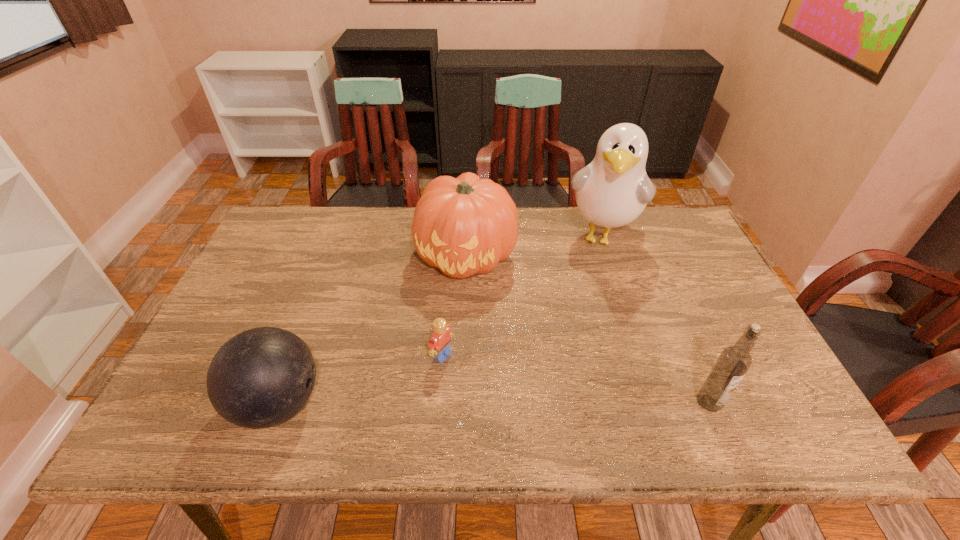
Find the location of a particular element. This screenshot has width=960, height=540. bowling ball is located at coordinates (261, 377).

You are a GUI agent. You are given a task and a screenshot of the screen. Output one action in this format:
    pyautogui.click(x=<x>, y=<y>)
    Task: Click on the second shortest object
    This screenshot has height=540, width=960.
    Given the screenshot: What is the action you would take?
    pyautogui.click(x=261, y=377)

You are a GUI agent. You are given a task and a screenshot of the screen. Output one action in this format:
    pyautogui.click(x=<x>, y=<y>)
    Task: Click on the vodka
    
    Given the screenshot: What is the action you would take?
    [x=734, y=361]

I want to click on the shortest object, so (439, 344).

You are a GUI agent. You are given a task and a screenshot of the screen. Output one action in this format:
    pyautogui.click(x=<x>, y=<y>)
    Task: Click on the pumpkin
    Image resolution: width=960 pixels, height=540 pixels.
    Given the screenshot: What is the action you would take?
    pyautogui.click(x=466, y=225)

Where is `the tallest object`? The image size is (960, 540). the tallest object is located at coordinates (613, 190).

Find the location of a particular element. The width and height of the screenshot is (960, 540). vacant area situated on the grip area of the second shortest object is located at coordinates (397, 403).

Find the location of a particular element. The image size is (960, 540). vacant region located on the front-facing side of the Lego is located at coordinates (493, 388).

You are a GUI agent. You are given a task and a screenshot of the screen. Output one action in this format:
    pyautogui.click(x=<x>, y=<y>)
    Task: Click on the vacant space positioned on the front-facing side of the Lego
    This screenshot has width=960, height=540.
    Given the screenshot: What is the action you would take?
    pyautogui.click(x=483, y=381)

The image size is (960, 540). I want to click on free space located on the front-facing side of the Lego, so click(x=479, y=379).